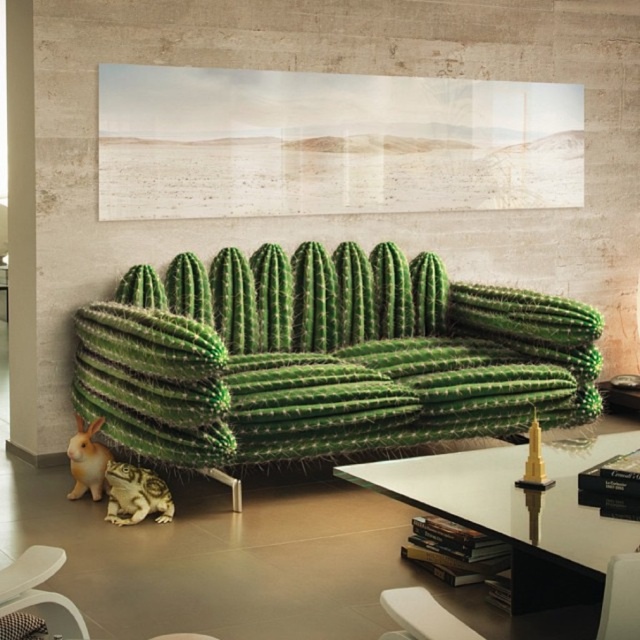
You are planning to place a new plant in the living room. The plant needs to be placed on the transparent glass table at center or near the green textured cactus at lower left. Considering their sizes, which location would allow the plant to have more space to grow?

The transparent glass table at center has a larger size compared to the green textured cactus at lower left, so placing the plant on the transparent glass table at center would provide more space for growth.

From the picture: You are arranging a tea set on the transparent glass table at center. To place a cup next to the green textured cactus at lower left, should you move the cup to the left or right side of the table?

The transparent glass table at center is to the right of green textured cactus at lower left, so to place the cup next to the cactus, you should move it to the left side of the table.

You are standing in the living room and want to place a new plant between the two points marked as point (620, 609) and point (102, 483). Which point should the plant be closer to in order to be nearer to the sofa?

The plant should be placed closer to point (620, 609) because it is closer to the viewer, which would place it nearer to the sofa.